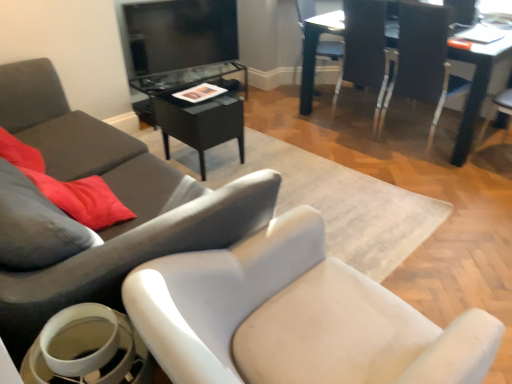
At what (x,y) coordinates should I click in order to perform the action: click on vacant region below matte black tv stand at upper center (from a real-world perspective). Please return your answer as a coordinate pair (x, y). Looking at the image, I should click on (180, 70).